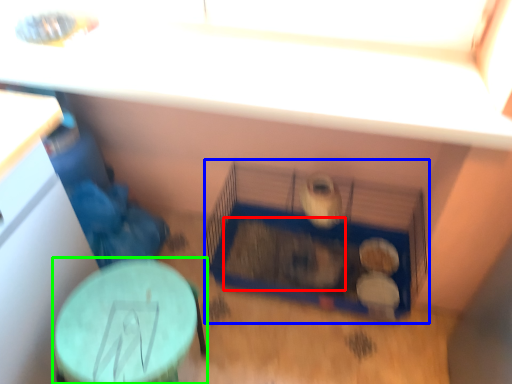
Question: Which object is positioned closest to animal (highlighted by a red box)? Select from bird cage (highlighted by a blue box) and table (highlighted by a green box).

Choices:
 (A) bird cage
 (B) table

Answer: (A)